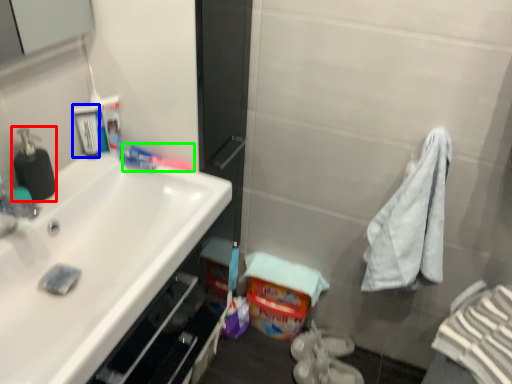
Question: Considering the real-world distances, which object is closest to soap dispenser (highlighted by a red box)? mouthwash (highlighted by a blue box) or toothpaste (highlighted by a green box).

Choices:
 (A) mouthwash
 (B) toothpaste

Answer: (A)